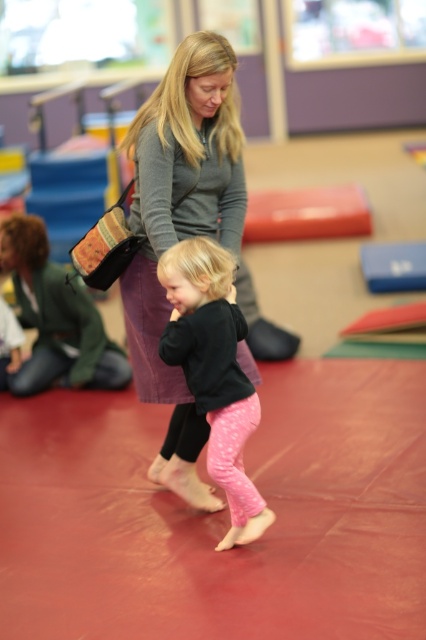
You are a photographer trying to capture a candid shot of the matte gray sweater at center and the pink textured leggings at center. Since you want to ensure both are in frame, which direction should you position your camera relative to the subjects?

The matte gray sweater at center is positioned on the left side of pink textured leggings at center, so you should position your camera to the right side of the subjects to ensure both the matte gray sweater at center and the pink textured leggings at center are in frame.

You are a fashion designer observing the gymnasium scene. You notice the matte gray sweater at center and the pink textured leggings at center. Which clothing item is positioned higher on the person?

The matte gray sweater at center is located above the pink textured leggings at center, so the matte gray sweater at center is positioned higher on the person.